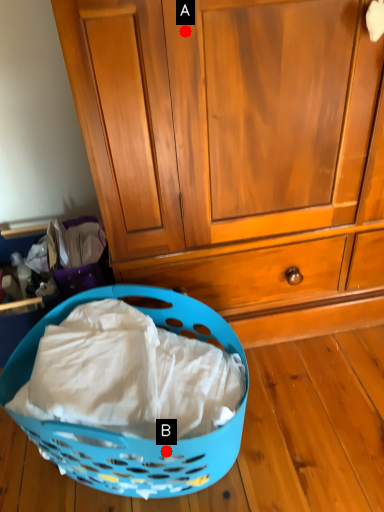
Question: Two points are circled on the image, labeled by A and B beside each circle. Which of the following is the farthest from the observer?

Choices:
 (A) A is further
 (B) B is further

Answer: (B)